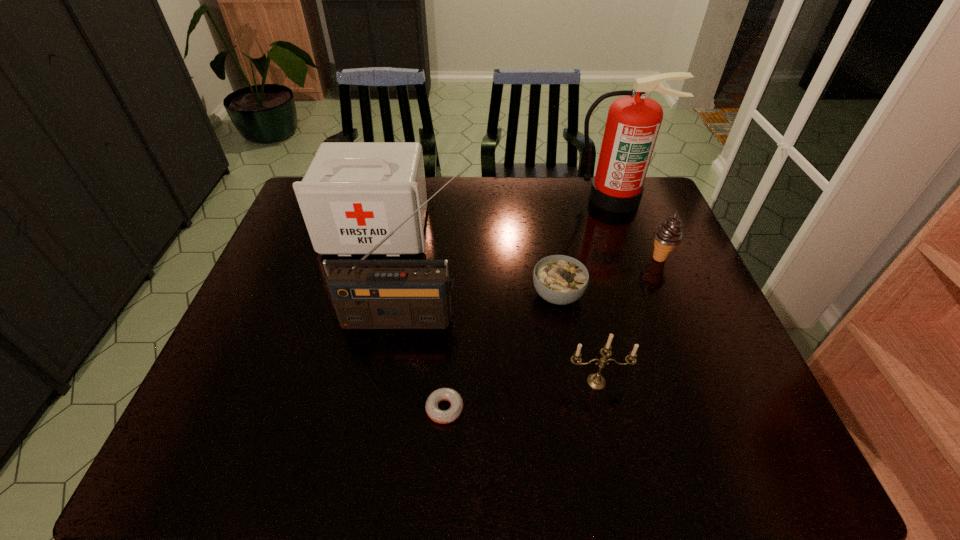
Find the location of a particular element. This screenshot has height=540, width=960. object that is at the far left corner is located at coordinates (353, 194).

I want to click on object that is at the far right corner, so click(x=633, y=122).

You are a GUI agent. You are given a task and a screenshot of the screen. Output one action in this format:
    pyautogui.click(x=<x>, y=<y>)
    Task: Click on the vacant region at the far edge of the desktop
    
    Given the screenshot: What is the action you would take?
    pyautogui.click(x=567, y=192)

I want to click on free space at the near edge of the desktop, so coord(396,457).

In the image, there is a desktop. Find the location of `vacant space at the left edge`. vacant space at the left edge is located at coordinates (273, 318).

I want to click on vacant region at the right edge, so click(x=695, y=366).

This screenshot has width=960, height=540. In the image, there is a desktop. Identify the location of free space at the far right corner. (654, 196).

The height and width of the screenshot is (540, 960). I want to click on vacant space that is in between the soup bowl and the radio receiver, so click(480, 306).

This screenshot has height=540, width=960. I want to click on unoccupied area between the radio receiver and the shortest object, so click(423, 363).

This screenshot has width=960, height=540. I want to click on free area in between the radio receiver and the icecream, so click(531, 288).